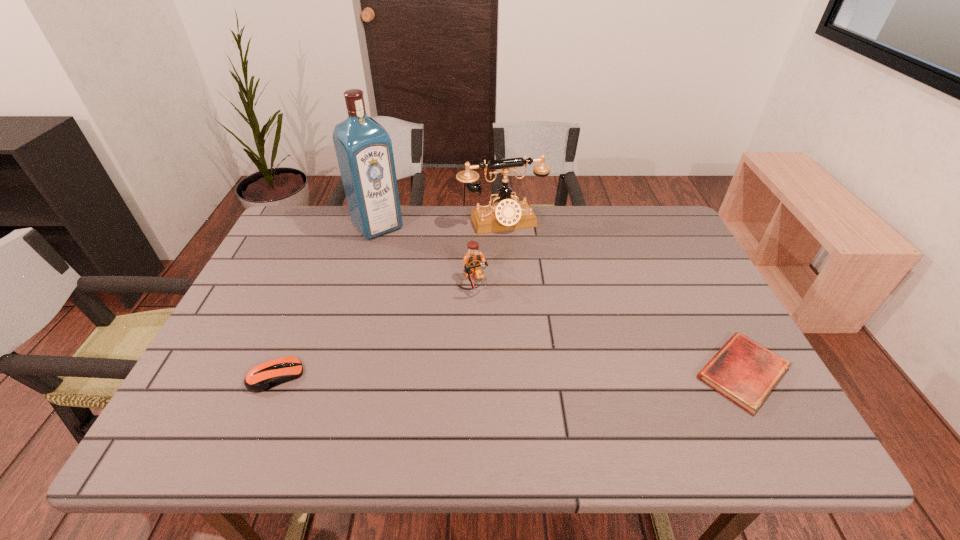
This screenshot has height=540, width=960. I want to click on free space between the tallest object and the second shortest object, so (327, 301).

You are a GUI agent. You are given a task and a screenshot of the screen. Output one action in this format:
    pyautogui.click(x=<x>, y=<y>)
    Task: Click on the free space between the shortest object and the liquor
    This screenshot has width=960, height=540.
    Given the screenshot: What is the action you would take?
    [560, 299]

Identify which object is located as the third nearest to the computer mouse. Please provide its 2D coordinates. Your answer should be formatted as a tuple, i.e. [(x, y)], where the tuple contains the x and y coordinates of a point satisfying the conditions above.

[(506, 214)]

This screenshot has width=960, height=540. Find the location of `object identified as the third closest to the fourth shortest object`. object identified as the third closest to the fourth shortest object is located at coordinates (743, 371).

In order to click on free space in the image that satisfies the following two spatial constraints: 1. on the back side of the computer mouse; 2. on the right side of the Lego in this screenshot , I will do `click(314, 283)`.